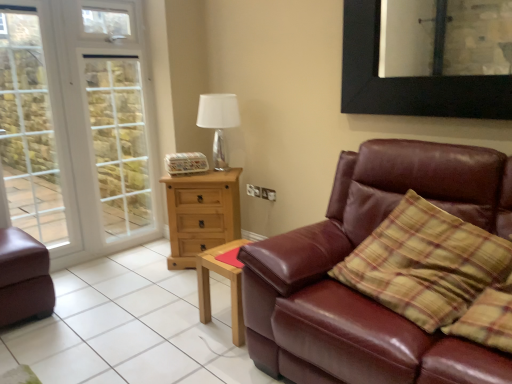
Question: Considering the relative sizes of white glossy table lamp at upper center and white glass screen door at left in the image provided, is white glossy table lamp at upper center shorter than white glass screen door at left?

Choices:
 (A) no
 (B) yes

Answer: (B)

Question: Is white glossy table lamp at upper center at the left side of white glass screen door at left?

Choices:
 (A) no
 (B) yes

Answer: (A)

Question: Is white glossy table lamp at upper center wider than white glass screen door at left?

Choices:
 (A) no
 (B) yes

Answer: (B)

Question: Is white glossy table lamp at upper center aimed at white glass screen door at left?

Choices:
 (A) yes
 (B) no

Answer: (B)

Question: From a real-world perspective, is white glossy table lamp at upper center on white glass screen door at left?

Choices:
 (A) yes
 (B) no

Answer: (B)

Question: From the image's perspective, relative to shiny brown leather couch at right, which is counted as the 1th studio couch, starting from the right, is white glass window at left above or below?

Choices:
 (A) above
 (B) below

Answer: (A)

Question: From a real-world perspective, is white glass window at left physically located above or below shiny brown leather couch at right, the 2th studio couch viewed from the left?

Choices:
 (A) above
 (B) below

Answer: (A)

Question: Would you say white glass window at left is to the left or to the right of shiny brown leather couch at right, the 2th studio couch viewed from the left, in the picture?

Choices:
 (A) right
 (B) left

Answer: (B)

Question: In terms of width, does white glass window at left look wider or thinner when compared to shiny brown leather couch at right, which is counted as the 1th studio couch, starting from the right?

Choices:
 (A) thin
 (B) wide

Answer: (A)

Question: Is point (54, 206) closer or farther from the camera than point (48, 299)?

Choices:
 (A) closer
 (B) farther

Answer: (B)

Question: From a real-world perspective, is white glass window at left physically located above or below matte brown leather couch at lower left, acting as the 1th studio couch starting from the left?

Choices:
 (A) above
 (B) below

Answer: (A)

Question: Based on their positions, is white glass window at left located to the left or right of matte brown leather couch at lower left, acting as the 1th studio couch starting from the left?

Choices:
 (A) right
 (B) left

Answer: (B)

Question: In terms of width, does white glass window at left look wider or thinner when compared to matte brown leather couch at lower left, acting as the 1th studio couch starting from the left?

Choices:
 (A) wide
 (B) thin

Answer: (B)

Question: Is light wood rectangular table at center bigger or smaller than light brown wooden chest of drawers at center?

Choices:
 (A) small
 (B) big

Answer: (A)

Question: Is point tap(238, 332) positioned closer to the camera than point tap(222, 231)?

Choices:
 (A) closer
 (B) farther

Answer: (A)